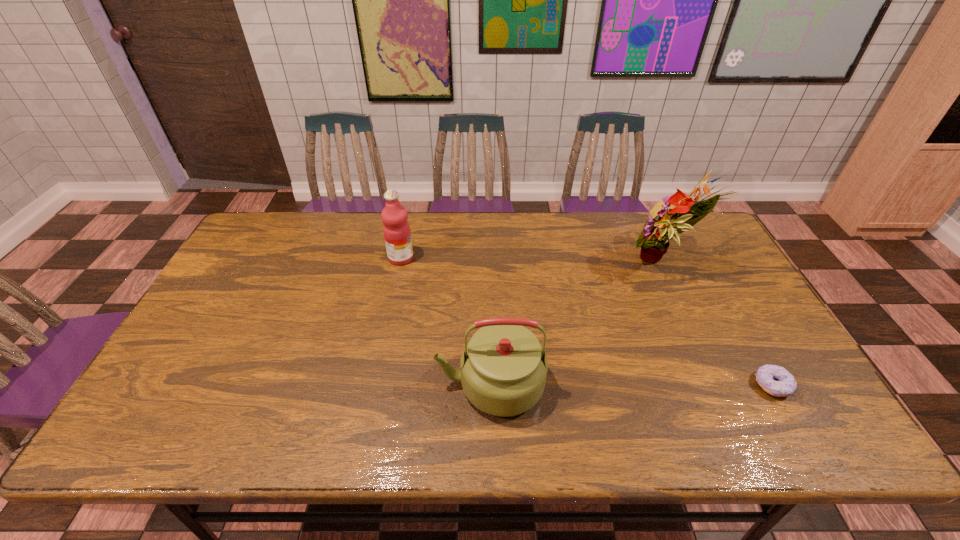
What are the coordinates of `vacant point located between the bouquet and the leftmost object` in the screenshot? It's located at (532, 260).

Image resolution: width=960 pixels, height=540 pixels. In order to click on vacant area between the leftmost object and the shortest object in this screenshot , I will do `click(587, 321)`.

This screenshot has height=540, width=960. I want to click on free spot between the doughnut and the bouquet, so click(718, 324).

Where is `empty space that is in between the doughnut and the kettle`? The width and height of the screenshot is (960, 540). empty space that is in between the doughnut and the kettle is located at coordinates (631, 384).

In order to click on object that stands as the closest to the tallest object in this screenshot , I will do `click(775, 380)`.

Identify the location of the closest object to the tallest object. (775, 380).

Locate an element on the screen. The height and width of the screenshot is (540, 960). free location that satisfies the following two spatial constraints: 1. at the spout of the doughnut; 2. on the left side of the third object from right to left is located at coordinates (491, 385).

This screenshot has width=960, height=540. I want to click on free region that satisfies the following two spatial constraints: 1. on the label of the fruit juice; 2. on the back side of the doughnut, so click(375, 385).

Locate an element on the screen. The width and height of the screenshot is (960, 540). vacant space that satisfies the following two spatial constraints: 1. at the spout of the doughnut; 2. on the left side of the kettle is located at coordinates (491, 385).

The image size is (960, 540). Find the location of `free region that satisfies the following two spatial constraints: 1. at the spout of the third object from right to left; 2. on the left side of the shortest object`. free region that satisfies the following two spatial constraints: 1. at the spout of the third object from right to left; 2. on the left side of the shortest object is located at coordinates (491, 385).